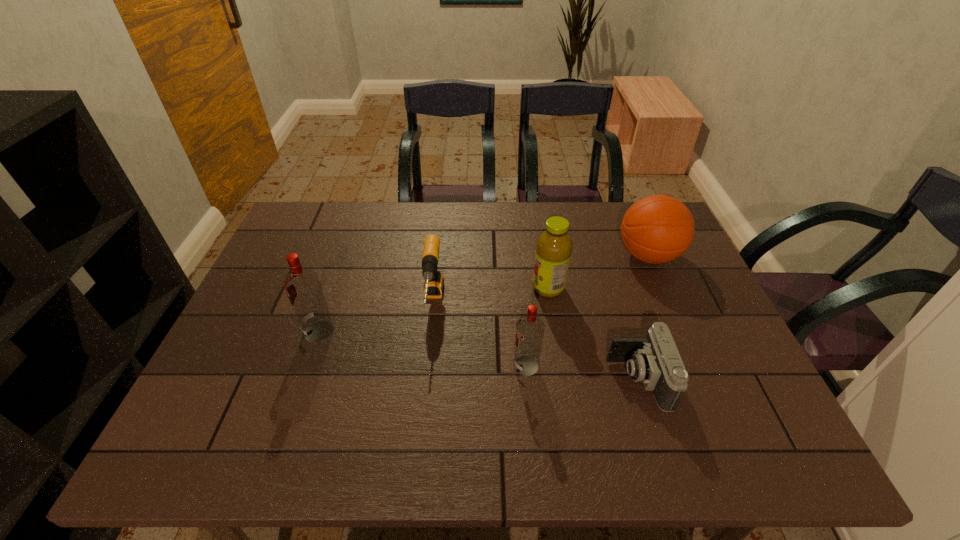
Locate an element on the screen. The width and height of the screenshot is (960, 540). the taller vodka is located at coordinates (302, 286).

This screenshot has height=540, width=960. What are the coordinates of `the farther vodka` in the screenshot? It's located at (302, 286).

Locate an element on the screen. Image resolution: width=960 pixels, height=540 pixels. the third object from left to right is located at coordinates (530, 329).

What are the coordinates of `the shorter vodka` in the screenshot? It's located at (530, 329).

Identify the location of the fourth object from left to right. Image resolution: width=960 pixels, height=540 pixels. click(x=554, y=246).

Find the location of a particular element. The width and height of the screenshot is (960, 540). basketball is located at coordinates (656, 229).

Find the location of `drill`. drill is located at coordinates 434,282.

This screenshot has height=540, width=960. What are the coordinates of `the second object from left to right` in the screenshot? It's located at (434, 282).

Where is `camera`? This screenshot has height=540, width=960. camera is located at coordinates (655, 361).

Identify the location of vacant space located 0.130m on the front label of the taller vodka. The width and height of the screenshot is (960, 540). (253, 331).